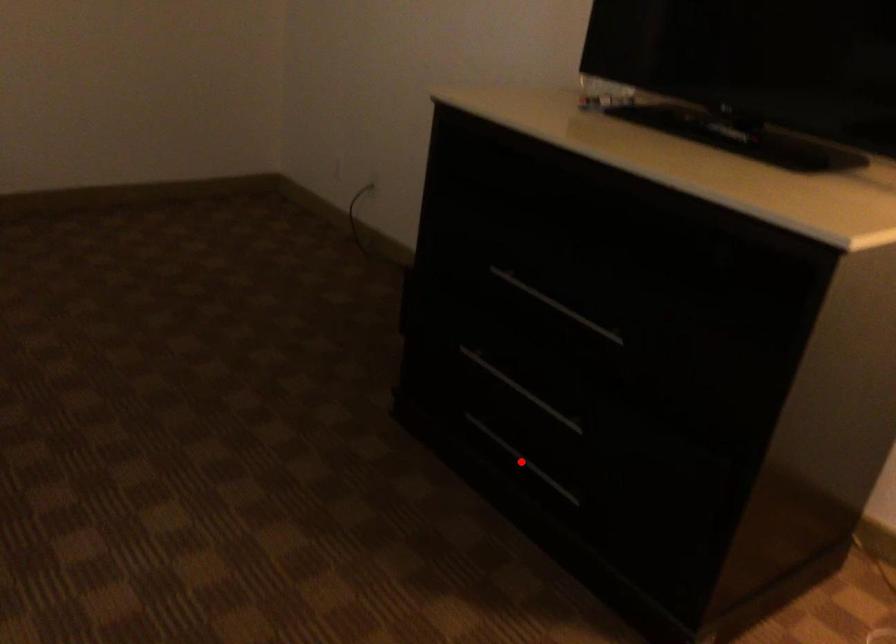
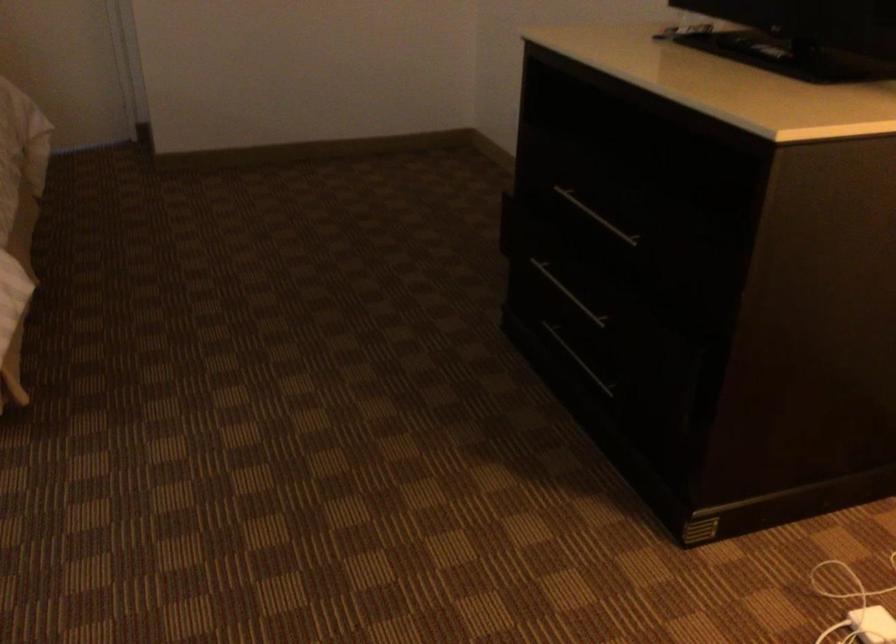
Question: I am providing you with two images of the same scene from different viewpoints. Given a red point in image1, look at the same physical point in image2. Is it:

Choices:
 (A) Closer to the viewpoint
 (B) Farther from the viewpoint

Answer: (B)